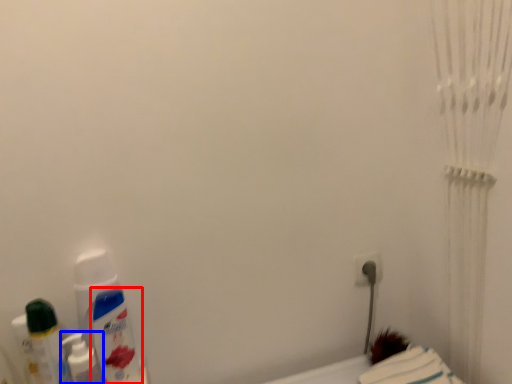
Question: Which object is further to the camera taking this photo, mouthwash (highlighted by a red box) or mouthwash (highlighted by a blue box)?

Choices:
 (A) mouthwash
 (B) mouthwash

Answer: (A)